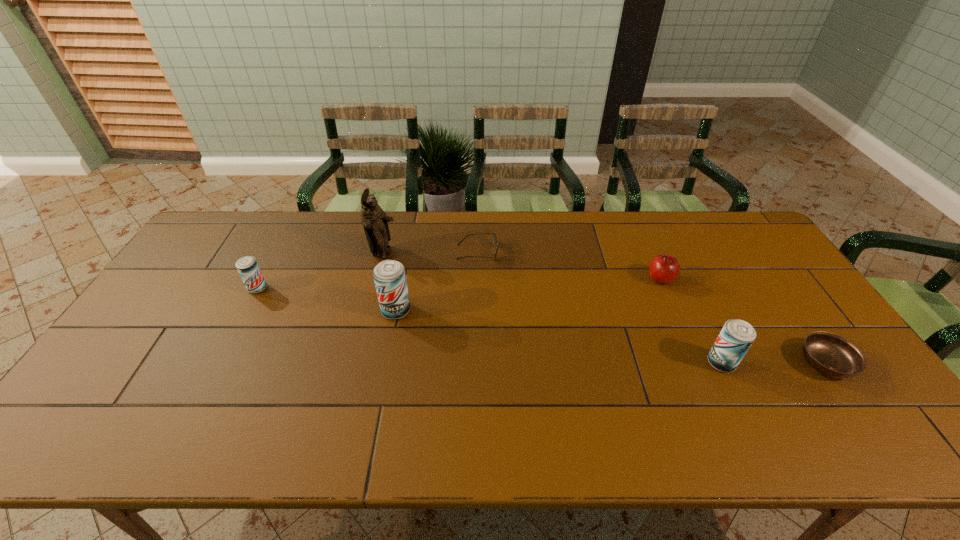
Find the location of a particular element. This screenshot has width=960, height=540. object present at the right edge is located at coordinates (832, 355).

This screenshot has height=540, width=960. I want to click on object located at the near right corner, so click(x=832, y=355).

Locate an element on the screen. Image resolution: width=960 pixels, height=540 pixels. vacant position at the far edge of the desktop is located at coordinates (633, 235).

The width and height of the screenshot is (960, 540). In the image, there is a desktop. Find the location of `vacant space at the near edge`. vacant space at the near edge is located at coordinates (274, 408).

In order to click on free region at the left edge in this screenshot , I will do `click(163, 320)`.

Identify the location of vacant space at the right edge of the desktop. (806, 305).

Locate an element on the screen. The width and height of the screenshot is (960, 540). free space between the fifth shortest object and the third nearest object is located at coordinates (559, 336).

Find the location of a particular element. This screenshot has width=960, height=540. free point between the second beer can from left to right and the farthest beer can is located at coordinates pos(326,299).

Find the location of a particular element. The height and width of the screenshot is (540, 960). unoccupied position between the nearest beer can and the soup bowl is located at coordinates (774, 363).

This screenshot has width=960, height=540. Identify the location of vacant space in between the third tallest object and the rightmost object. tap(774, 363).